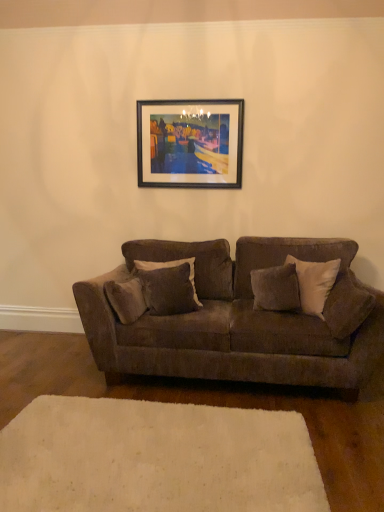
Locate an element on the screen. This screenshot has width=384, height=512. empty space that is ontop of wooden-framed artwork at upper center (from a real-world perspective) is located at coordinates (182, 99).